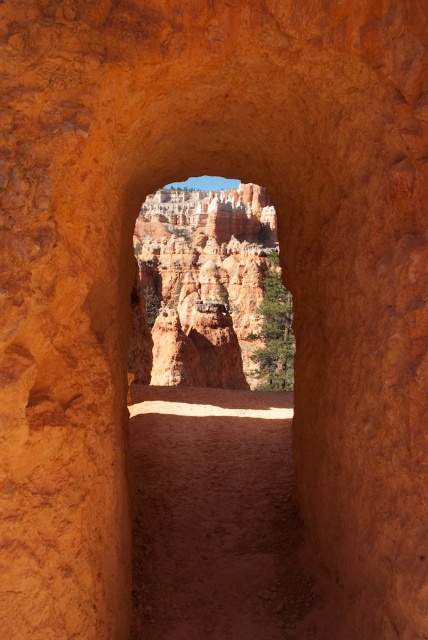
Is the position of dusty reddish-brown dirt path at center less distant than that of rustic sandstone hoodoo at center?

Yes, dusty reddish-brown dirt path at center is in front of rustic sandstone hoodoo at center.

Who is lower down, dusty reddish-brown dirt path at center or rustic sandstone hoodoo at center?

dusty reddish-brown dirt path at center

Identify the location of dusty reddish-brown dirt path at center. Image resolution: width=428 pixels, height=640 pixels. (219, 518).

Image resolution: width=428 pixels, height=640 pixels. Identify the location of dusty reddish-brown dirt path at center. (219, 518).